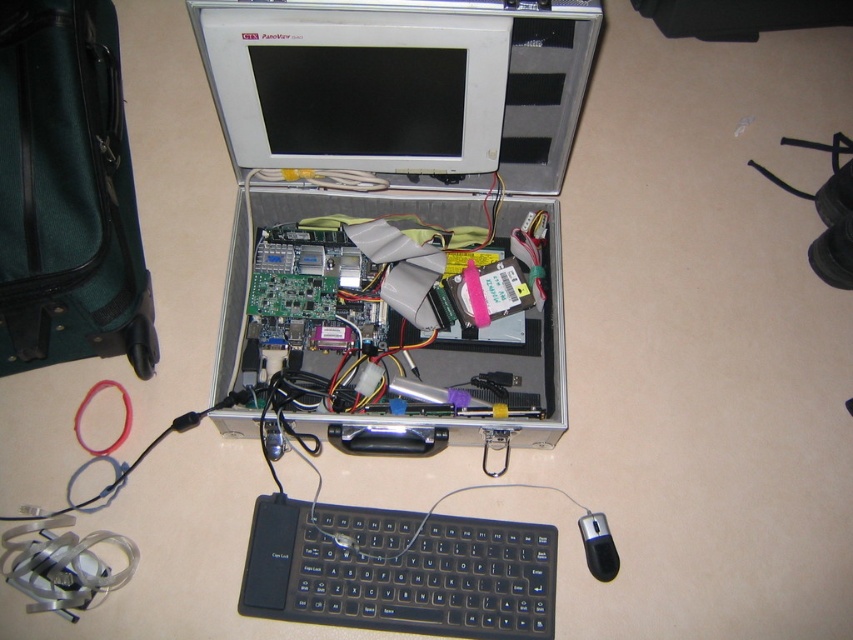
Question: Can you confirm if black plastic keyboard at lower center is positioned below black plastic mouse at lower right?

Choices:
 (A) no
 (B) yes

Answer: (B)

Question: Based on their relative distances, which object is farther from the black plastic keyboard at lower center?

Choices:
 (A) black plastic mouse at lower right
 (B) silver metallic computer at center

Answer: (B)

Question: Which of the following is the farthest from the observer?

Choices:
 (A) (592, 529)
 (B) (386, 429)
 (C) (405, 568)

Answer: (A)

Question: Considering the real-world distances, which object is farthest from the black plastic keyboard at lower center?

Choices:
 (A) black plastic mouse at lower right
 (B) silver metallic computer at center

Answer: (B)

Question: Is silver metallic computer at center smaller than black plastic mouse at lower right?

Choices:
 (A) no
 (B) yes

Answer: (A)

Question: Is silver metallic computer at center behind black plastic keyboard at lower center?

Choices:
 (A) yes
 (B) no

Answer: (B)